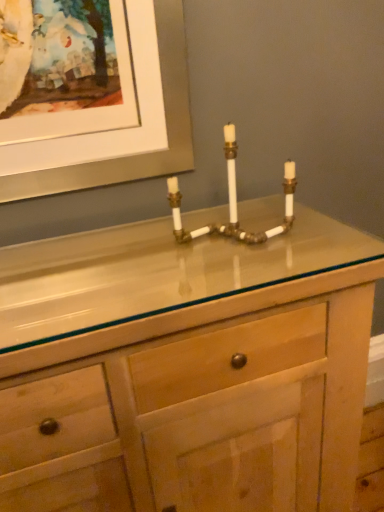
Find the location of a particular element. free spot above natural wood cabinet at center (from a real-world perspective) is located at coordinates (134, 260).